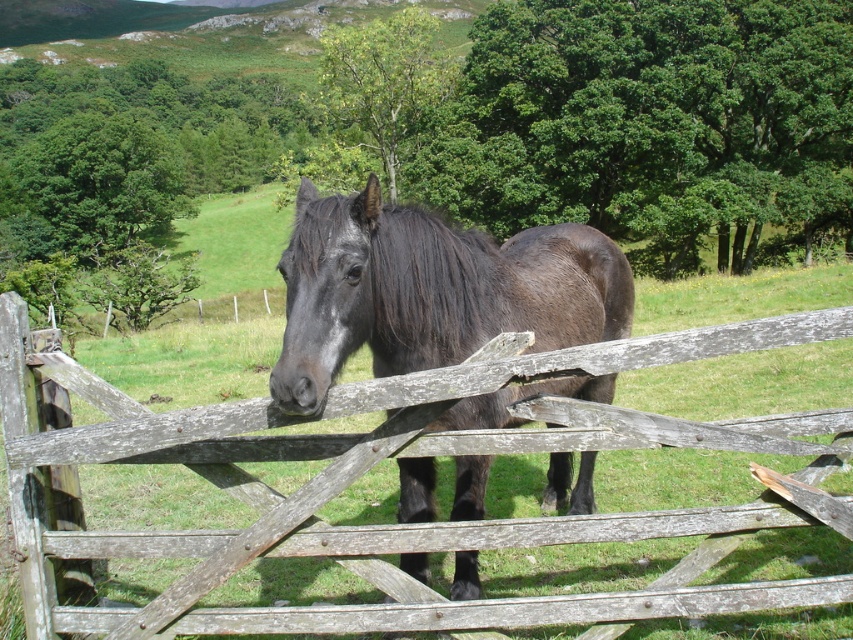
You are a farmer checking the fence for repairs. You notice the weathered wood fence at center and the shiny black horse at center. Which object is wider?

The weathered wood fence at center is wider than the shiny black horse at center.

You are a farmer checking the boundaries of your property. You see the weathered wood fence at center and the shiny black horse at center. Which object takes up more space in the image?

The weathered wood fence at center has a larger size compared to the shiny black horse at center, so it takes up more space in the image.

From the picture: You are a farmer standing next to the weathered wood fence at center and want to throw a carrot to the shiny black horse at center. Can you reach the horse with your arm stretched out?

The distance between the weathered wood fence at center and the shiny black horse at center is 2.55 meters. Since the average human arm span is about 1.5 meters, you cannot reach the horse with your arm stretched out.